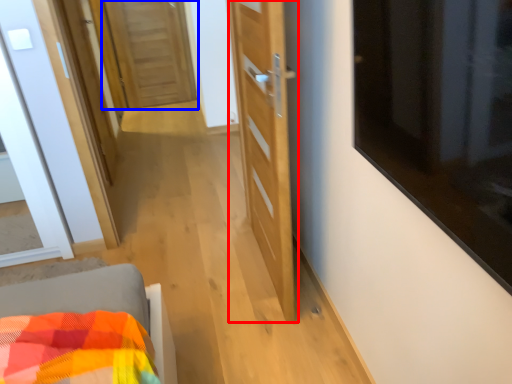
Question: Among these objects, which one is farthest to the camera, door (highlighted by a red box) or door (highlighted by a blue box)?

Choices:
 (A) door
 (B) door

Answer: (B)